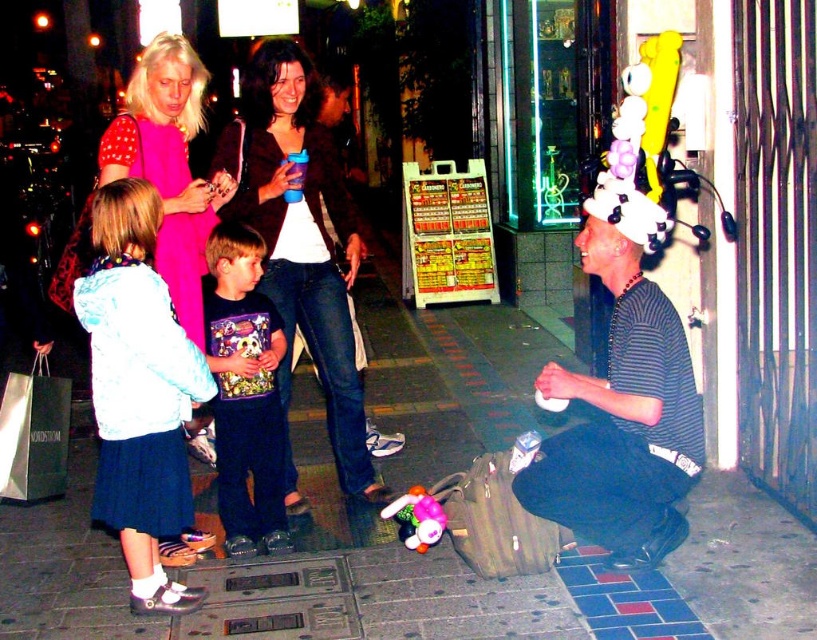
Identify the location of matte black jacket at center. The height and width of the screenshot is (640, 817). (301, 241).

From the picture: Between blue fabric skirt at lower left and plush multicolored toy at lower center, which one has less height?

plush multicolored toy at lower center is shorter.

Does point (137, 289) lie in front of point (405, 529)?

Yes, point (137, 289) is in front of point (405, 529).

Which is behind, point (210, 397) or point (436, 502)?

Point (436, 502)

What are the coordinates of `blue fabric skirt at lower left` in the screenshot? It's located at (137, 390).

Is point (101, 307) behind point (243, 180)?

That is False.

Image resolution: width=817 pixels, height=640 pixels. In order to click on blue fabric skirt at lower left in this screenshot , I will do `click(137, 390)`.

Does point (118, 406) come closer to viewer compared to point (342, 179)?

Yes, it is in front of point (342, 179).

This screenshot has width=817, height=640. What are the coordinates of `blue fabric skirt at lower left` in the screenshot? It's located at (137, 390).